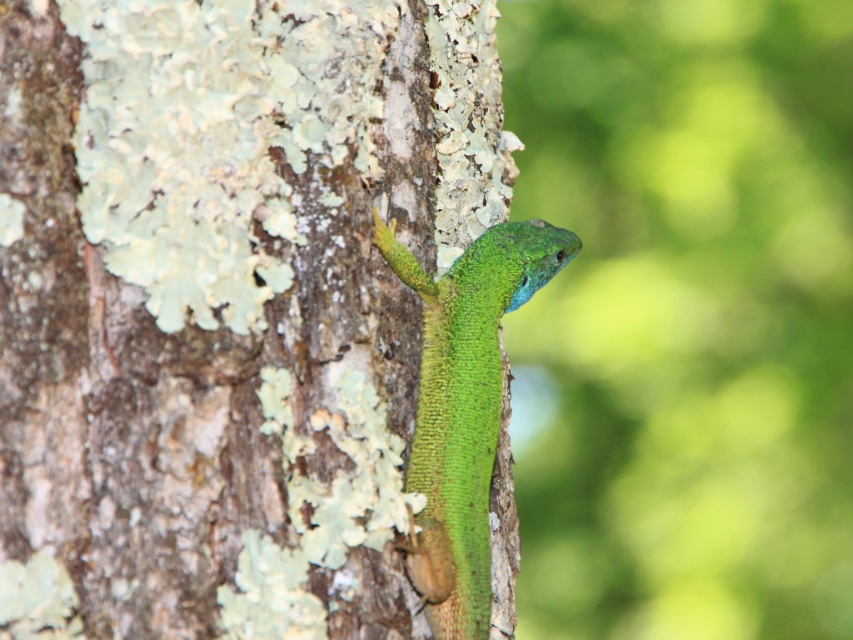
Which is above, green rough bark tree at center or green matte lizard at center?

green rough bark tree at center is above.

Is green rough bark tree at center in front of green matte lizard at center?

Yes, it is.

You are a GUI agent. You are given a task and a screenshot of the screen. Output one action in this format:
    pyautogui.click(x=<x>, y=<y>)
    Task: Click on the green rough bark tree at center
    
    Given the screenshot: What is the action you would take?
    pyautogui.click(x=224, y=304)